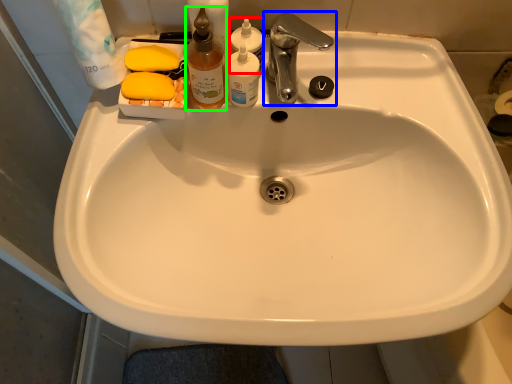
Question: Considering the real-world distances, which object is closest to cleaning product (highlighted by a red box)? tap (highlighted by a blue box) or cleaning product (highlighted by a green box).

Choices:
 (A) tap
 (B) cleaning product

Answer: (A)